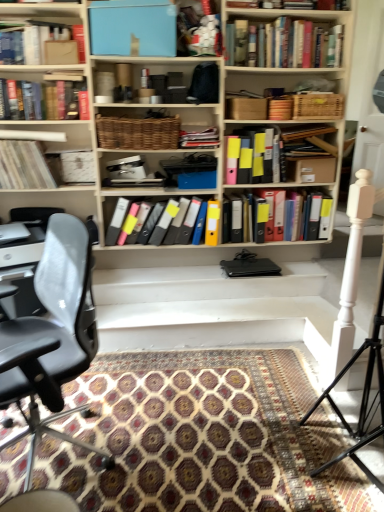
Question: Could you tell me if hardcover book at upper left, the 5th book positioned from the bottom, is turned towards multicolored plastic folders at center, the 8th book positioned from the top?

Choices:
 (A) yes
 (B) no

Answer: (B)

Question: From the image's perspective, is hardcover book at upper left, the 4th book from the top, located above multicolored plastic folders at center, the 8th book positioned from the top?

Choices:
 (A) no
 (B) yes

Answer: (B)

Question: Can you confirm if hardcover book at upper left, the 4th book from the top, is bigger than multicolored plastic folders at center, the 8th book positioned from the top?

Choices:
 (A) yes
 (B) no

Answer: (B)

Question: Is hardcover book at upper left, the 5th book positioned from the bottom, smaller than multicolored plastic folders at center, the 1th book from the bottom?

Choices:
 (A) no
 (B) yes

Answer: (B)

Question: Is hardcover book at upper left, the 4th book from the top, to the left of multicolored plastic folders at center, the 8th book positioned from the top, from the viewer's perspective?

Choices:
 (A) no
 (B) yes

Answer: (B)

Question: From their relative heights in the image, would you say white matte tripod at right is taller or shorter than matte black folders at center, acting as the 4th book starting from the bottom?

Choices:
 (A) tall
 (B) short

Answer: (A)

Question: Considering their positions, is white matte tripod at right located in front of or behind matte black folders at center, the fifth book positioned from the top?

Choices:
 (A) behind
 (B) front

Answer: (B)

Question: From the image's perspective, is white matte tripod at right located above or below matte black folders at center, the fifth book positioned from the top?

Choices:
 (A) above
 (B) below

Answer: (B)

Question: Looking at their shapes, would you say white matte tripod at right is wider or thinner than matte black folders at center, acting as the 4th book starting from the bottom?

Choices:
 (A) thin
 (B) wide

Answer: (B)

Question: From the image's perspective, is matte black laptop at left located above or below white matte stairs at center?

Choices:
 (A) above
 (B) below

Answer: (A)

Question: Looking at their shapes, would you say matte black laptop at left is wider or thinner than white matte stairs at center?

Choices:
 (A) thin
 (B) wide

Answer: (A)

Question: Relative to white matte stairs at center, is matte black laptop at left in front or behind?

Choices:
 (A) behind
 (B) front

Answer: (A)

Question: Considering the positions of point (39, 198) and point (309, 275), is point (39, 198) closer or farther from the camera than point (309, 275)?

Choices:
 (A) farther
 (B) closer

Answer: (B)

Question: Relative to black leather chair at left, is multicolored plastic folders at center, the 1th book from the bottom, in front or behind?

Choices:
 (A) behind
 (B) front

Answer: (A)

Question: Considering the positions of multicolored plastic folders at center, the 1th book from the bottom, and black leather chair at left in the image, is multicolored plastic folders at center, the 1th book from the bottom, bigger or smaller than black leather chair at left?

Choices:
 (A) big
 (B) small

Answer: (B)